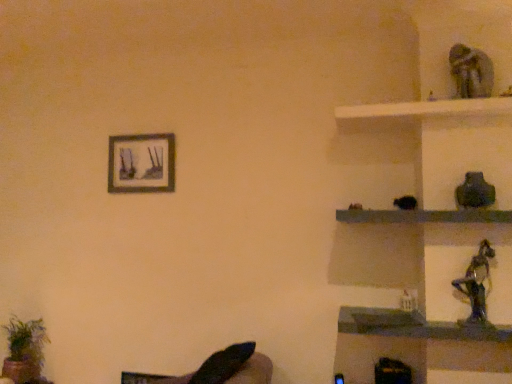
The image size is (512, 384). What do you see at coordinates (424, 216) in the screenshot?
I see `black glossy statue at upper right, arranged as the second shelf when ordered from the bottom` at bounding box center [424, 216].

This screenshot has width=512, height=384. Identify the location of matte black picture frame at upper left. (141, 163).

Describe the element at coordinates (416, 344) in the screenshot. The image size is (512, 384). I see `black glossy statue at lower right, placed as the first shelf when sorted from bottom to top` at that location.

Where is `green leafy plant at lower left`? green leafy plant at lower left is located at coordinates (25, 351).

Identify the location of swivel chair behind the black glossy statue at upper right, arranged as the second shelf when ordered from the bottom. This screenshot has width=512, height=384. (217, 369).

Is black glossy statue at upper right, the 1th shelf in the top-to-bottom sequence, to the left of black leather swivel chair at lower left from the viewer's perspective?

No, black glossy statue at upper right, the 1th shelf in the top-to-bottom sequence, is not to the left of black leather swivel chair at lower left.

Is black leather swivel chair at lower left located within black glossy statue at upper right, the 1th shelf in the top-to-bottom sequence?

Definitely not — black leather swivel chair at lower left is not inside black glossy statue at upper right, the 1th shelf in the top-to-bottom sequence.

Which object is thinner, matte black picture frame at upper left or black glossy statue at lower right, the 2th shelf from the top?

With smaller width is matte black picture frame at upper left.

Considering the sizes of objects matte black picture frame at upper left and black glossy statue at lower right, the 2th shelf from the top, in the image provided, who is bigger, matte black picture frame at upper left or black glossy statue at lower right, the 2th shelf from the top,?

Bigger between the two is black glossy statue at lower right, the 2th shelf from the top.

Locate an element on the screen. This screenshot has height=384, width=512. picture frame that is on the left side of black glossy statue at lower right, placed as the first shelf when sorted from bottom to top is located at coordinates (141, 163).

Is the depth of matte black picture frame at upper left greater than that of black glossy statue at lower right, placed as the first shelf when sorted from bottom to top?

Yes, matte black picture frame at upper left is behind black glossy statue at lower right, placed as the first shelf when sorted from bottom to top.

Measure the distance between black leather swivel chair at lower left and green leafy plant at lower left.

black leather swivel chair at lower left and green leafy plant at lower left are 4.28 feet apart from each other.

Would you say black leather swivel chair at lower left is a long distance from green leafy plant at lower left?

Yes.

From a real-world perspective, is black leather swivel chair at lower left over green leafy plant at lower left?

No.

Considering the relative sizes of black leather swivel chair at lower left and green leafy plant at lower left in the image provided, is black leather swivel chair at lower left thinner than green leafy plant at lower left?

No, black leather swivel chair at lower left is not thinner than green leafy plant at lower left.

Is black glossy statue at lower right, placed as the first shelf when sorted from bottom to top, positioned with its back to black glossy statue at upper right, arranged as the second shelf when ordered from the bottom?

No, black glossy statue at lower right, placed as the first shelf when sorted from bottom to top, is not facing away from black glossy statue at upper right, arranged as the second shelf when ordered from the bottom.

Looking at this image, can you tell me how much black glossy statue at lower right, the 2th shelf from the top, and black glossy statue at upper right, arranged as the second shelf when ordered from the bottom, differ in facing direction?

black glossy statue at lower right, the 2th shelf from the top, and black glossy statue at upper right, arranged as the second shelf when ordered from the bottom, are facing 0.000967 degrees away from each other.

Would you consider black glossy statue at lower right, the 2th shelf from the top, to be distant from black glossy statue at upper right, the 1th shelf in the top-to-bottom sequence?

Actually, black glossy statue at lower right, the 2th shelf from the top, and black glossy statue at upper right, the 1th shelf in the top-to-bottom sequence, are a little close together.

Looking at this image, from a real-world perspective, is black glossy statue at lower right, the 2th shelf from the top, over black glossy statue at upper right, the 1th shelf in the top-to-bottom sequence?

No, from a real-world perspective, black glossy statue at lower right, the 2th shelf from the top, is not on top of black glossy statue at upper right, the 1th shelf in the top-to-bottom sequence.

Relative to black leather swivel chair at lower left, is green leafy plant at lower left in front or behind?

green leafy plant at lower left is positioned farther from the viewer than black leather swivel chair at lower left.

Does green leafy plant at lower left contain black leather swivel chair at lower left?

That's incorrect, black leather swivel chair at lower left is not inside green leafy plant at lower left.

Are green leafy plant at lower left and black leather swivel chair at lower left located far from each other?

Yes, green leafy plant at lower left is far from black leather swivel chair at lower left.

Is green leafy plant at lower left bigger than black leather swivel chair at lower left?

Incorrect, green leafy plant at lower left is not larger than black leather swivel chair at lower left.

Considering the points (137, 377) and (481, 274), which point is behind, point (137, 377) or point (481, 274)?

The point (137, 377) is behind.

Which is more to the right, black leather swivel chair at lower left or shiny metallic figurine at right?

shiny metallic figurine at right is more to the right.

Which of these two, black leather swivel chair at lower left or shiny metallic figurine at right, stands shorter?

black leather swivel chair at lower left is shorter.

From the image's perspective, relative to shiny metallic figurine at right, is black leather swivel chair at lower left above or below?

Based on their image positions, black leather swivel chair at lower left is located beneath shiny metallic figurine at right.

Considering the sizes of shiny metallic figurine at right and green leafy plant at lower left in the image, is shiny metallic figurine at right taller or shorter than green leafy plant at lower left?

shiny metallic figurine at right is shorter than green leafy plant at lower left.

Considering the relative positions of shiny metallic figurine at right and green leafy plant at lower left in the image provided, is shiny metallic figurine at right to the left of green leafy plant at lower left from the viewer's perspective?

No, shiny metallic figurine at right is not to the left of green leafy plant at lower left.

From a real-world perspective, is shiny metallic figurine at right under green leafy plant at lower left?

No, from a real-world perspective, shiny metallic figurine at right is not under green leafy plant at lower left.

Where is `swivel chair that is on the left side of black glossy statue at upper right, the 1th shelf in the top-to-bottom sequence`? The height and width of the screenshot is (384, 512). swivel chair that is on the left side of black glossy statue at upper right, the 1th shelf in the top-to-bottom sequence is located at coordinates (217, 369).

Starting from the matte black picture frame at upper left, which shelf is the 1st one to the right? Please provide its 2D coordinates.

[(416, 344)]

Based on their spatial positions, is black glossy statue at lower right, the 2th shelf from the top, or black glossy statue at upper right, arranged as the second shelf when ordered from the bottom, closer to green leafy plant at lower left?

black glossy statue at lower right, the 2th shelf from the top, is positioned closer to the anchor green leafy plant at lower left.

Considering their positions, is matte black picture frame at upper left positioned further to green leafy plant at lower left than shiny metallic figurine at right?

Based on the image, shiny metallic figurine at right appears to be further to green leafy plant at lower left.

Looking at the image, which one is located further to black glossy statue at lower right, the 2th shelf from the top, black leather swivel chair at lower left or black glossy statue at upper right, arranged as the second shelf when ordered from the bottom?

black leather swivel chair at lower left.

Considering their positions, is shiny metallic figurine at right positioned closer to matte black picture frame at upper left than black glossy statue at upper right, arranged as the second shelf when ordered from the bottom?

The object closer to matte black picture frame at upper left is black glossy statue at upper right, arranged as the second shelf when ordered from the bottom.

Consider the image. Considering their positions, is green leafy plant at lower left positioned further to black glossy statue at lower right, the 2th shelf from the top, than matte black picture frame at upper left?

green leafy plant at lower left.

Looking at this image, when comparing their distances from shiny metallic figurine at right, does black leather swivel chair at lower left or black glossy statue at lower right, the 2th shelf from the top, seem further?

black leather swivel chair at lower left.

Estimate the real-world distances between objects in this image. Which object is further from shiny metallic figurine at right, matte black picture frame at upper left or black glossy statue at upper right, the 1th shelf in the top-to-bottom sequence?

matte black picture frame at upper left is further to shiny metallic figurine at right.

Consider the image. When comparing their distances from black leather swivel chair at lower left, does matte black picture frame at upper left or green leafy plant at lower left seem closer?

matte black picture frame at upper left is closer to black leather swivel chair at lower left.

In order to click on shelf between black leather swivel chair at lower left and black glossy statue at upper right, the 1th shelf in the top-to-bottom sequence in this screenshot , I will do `click(416, 344)`.

Where is `swivel chair between matte black picture frame at upper left and black glossy statue at lower right, the 2th shelf from the top, in the horizontal direction`? The height and width of the screenshot is (384, 512). swivel chair between matte black picture frame at upper left and black glossy statue at lower right, the 2th shelf from the top, in the horizontal direction is located at coordinates (217, 369).

Locate an element on the screen. This screenshot has width=512, height=384. shelf between matte black picture frame at upper left and black glossy statue at upper right, the 1th shelf in the top-to-bottom sequence, in the horizontal direction is located at coordinates (416, 344).

At what (x,y) coordinates should I click in order to perform the action: click on swivel chair situated between matte black picture frame at upper left and black glossy statue at upper right, arranged as the second shelf when ordered from the bottom, from left to right. Please return your answer as a coordinate pair (x, y). This screenshot has height=384, width=512. Looking at the image, I should click on (217, 369).